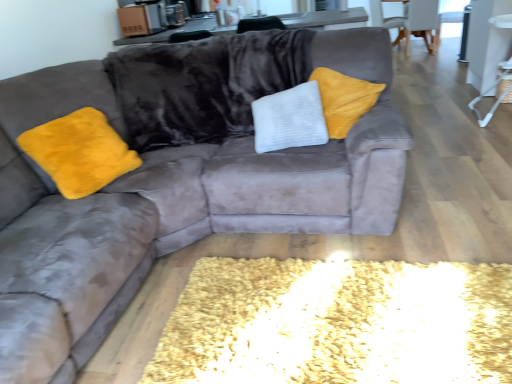
Question: Considering their positions, is white plastic side table at right located in front of or behind velvet gray armchair at upper right, arranged as the 2th armchair when viewed from the front?

Choices:
 (A) behind
 (B) front

Answer: (B)

Question: From a real-world perspective, is white plastic side table at right physically located above or below velvet gray armchair at upper right, which appears as the 1th armchair when viewed from the back?

Choices:
 (A) above
 (B) below

Answer: (A)

Question: Which of these objects is positioned closest to the white plastic side table at right?

Choices:
 (A) velvet gray armchair at upper right, which appears as the 1th armchair when viewed from the back
 (B) white fabric armchair at upper right, the 1th armchair from the front

Answer: (B)

Question: Which of these objects is positioned closest to the velvet gray armchair at upper right, arranged as the 2th armchair when viewed from the front?

Choices:
 (A) white plastic side table at right
 (B) white fabric armchair at upper right, the 1th armchair from the front

Answer: (B)